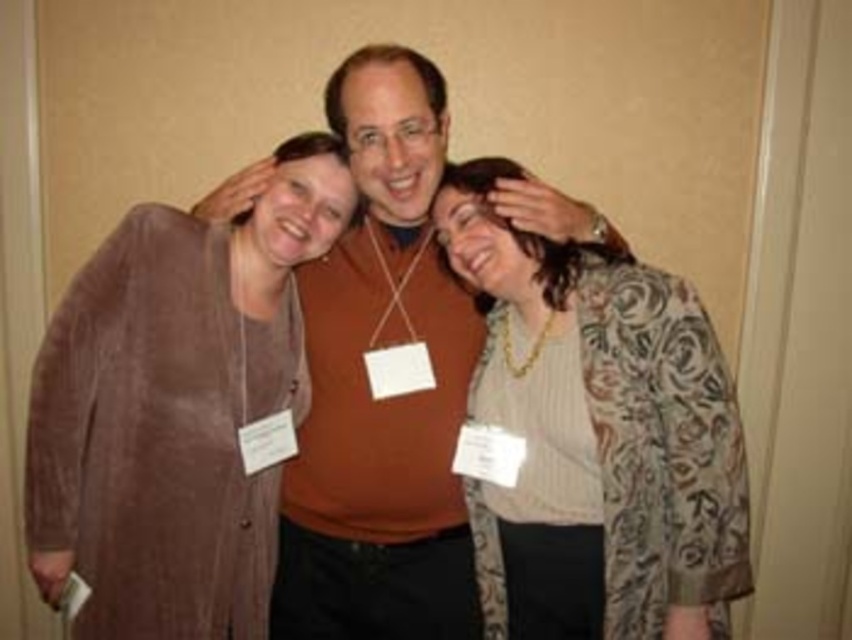
Question: Considering the relative positions of matte brown cardigan at left and patterned silk blouse at center in the image provided, where is matte brown cardigan at left located with respect to patterned silk blouse at center?

Choices:
 (A) above
 (B) below

Answer: (A)

Question: Is matte brown cardigan at left bigger than patterned silk blouse at center?

Choices:
 (A) no
 (B) yes

Answer: (A)

Question: Based on their relative distances, which object is nearer to the matte brown sweater at center?

Choices:
 (A) matte brown cardigan at left
 (B) patterned silk blouse at center

Answer: (B)

Question: Considering the real-world distances, which object is closest to the matte brown cardigan at left?

Choices:
 (A) patterned silk blouse at center
 (B) matte brown sweater at center

Answer: (B)

Question: Can you confirm if matte brown cardigan at left is positioned below matte brown sweater at center?

Choices:
 (A) yes
 (B) no

Answer: (A)

Question: Which of these objects is positioned closest to the patterned silk blouse at center?

Choices:
 (A) matte brown cardigan at left
 (B) matte brown sweater at center

Answer: (B)